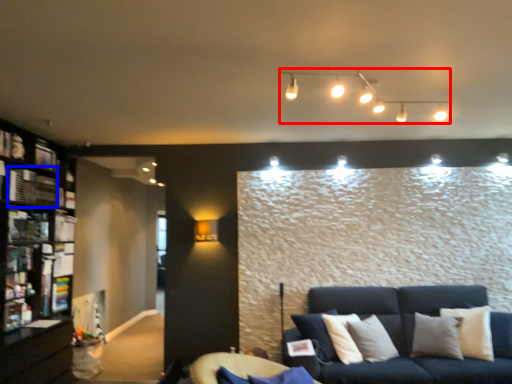
Question: Which object appears closest to the camera in this image, lamp (highlighted by a red box) or shelf (highlighted by a blue box)?

Choices:
 (A) lamp
 (B) shelf

Answer: (A)